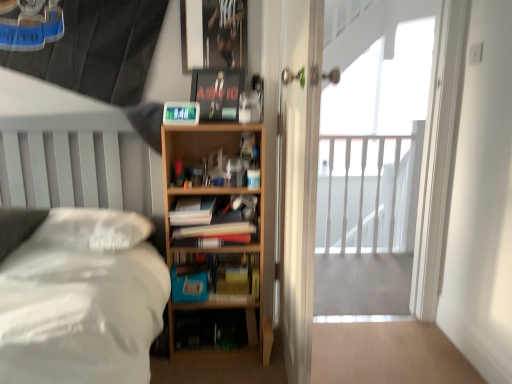
The height and width of the screenshot is (384, 512). Identify the location of white glossy screen door at center. (298, 178).

The image size is (512, 384). What do you see at coordinates (367, 192) in the screenshot? I see `white wooden railing at upper right` at bounding box center [367, 192].

This screenshot has width=512, height=384. In order to click on white wooden railing at upper right in this screenshot , I will do `click(367, 192)`.

This screenshot has width=512, height=384. Identify the location of white wooden railing at upper right. (376, 128).

The width and height of the screenshot is (512, 384). What are the coordinates of `hardcover book at center, the first book when ordered from bottom to top` in the screenshot? It's located at (220, 276).

Describe the element at coordinates (220, 276) in the screenshot. This screenshot has height=384, width=512. I see `hardcover book at center, acting as the second book starting from the top` at that location.

Locate an element on the screen. The image size is (512, 384). white glossy screen door at center is located at coordinates (298, 178).

Could you tell me if white glossy screen door at center is facing matte black paperback book at upper center, the 2th paperback book from the bottom?

No, white glossy screen door at center is not facing towards matte black paperback book at upper center, the 2th paperback book from the bottom.

Is white glossy screen door at center directly adjacent to matte black paperback book at upper center, the 2th paperback book from the bottom?

There is a gap between white glossy screen door at center and matte black paperback book at upper center, the 2th paperback book from the bottom.

Between white glossy screen door at center and matte black paperback book at upper center, placed as the first paperback book when sorted from top to bottom, which one has larger width?

Wider between the two is white glossy screen door at center.

Which point is more distant from viewer, (290,173) or (229,93)?

The point (229,93) is farther from the camera.

Measure the distance between white wooden railing at upper right and wooden bookcase at center.

white wooden railing at upper right is 5.15 feet from wooden bookcase at center.

Is wooden bookcase at center located within white wooden railing at upper right?

No.

Considering the positions of objects white wooden railing at upper right and wooden bookcase at center in the image provided, who is more to the left, white wooden railing at upper right or wooden bookcase at center?

wooden bookcase at center is more to the left.

From a real-world perspective, who is located lower, white wooden railing at upper right or wooden bookcase at center?

In real-world perspective, wooden bookcase at center is lower.

Between hardcover book at center, acting as the second book starting from the top, and matte black paperback book at upper center, the 2th paperback book from the bottom, which one is positioned behind?

Positioned behind is hardcover book at center, acting as the second book starting from the top.

From a real-world perspective, is hardcover book at center, the first book when ordered from bottom to top, over matte black paperback book at upper center, placed as the first paperback book when sorted from top to bottom?

No, from a real-world perspective, hardcover book at center, the first book when ordered from bottom to top, is not above matte black paperback book at upper center, placed as the first paperback book when sorted from top to bottom.

How many degrees apart are the facing directions of hardcover book at center, acting as the second book starting from the top, and matte black paperback book at upper center, placed as the first paperback book when sorted from top to bottom?

The angular difference between hardcover book at center, acting as the second book starting from the top, and matte black paperback book at upper center, placed as the first paperback book when sorted from top to bottom, is 16.7 degrees.

Considering the sizes of objects hardcover book at center, the first book when ordered from bottom to top, and matte black paperback book at upper center, placed as the first paperback book when sorted from top to bottom, in the image provided, who is thinner, hardcover book at center, the first book when ordered from bottom to top, or matte black paperback book at upper center, placed as the first paperback book when sorted from top to bottom,?

With smaller width is hardcover book at center, the first book when ordered from bottom to top.

How far apart are blue matte paperback book at lower center, the first paperback book ordered from the bottom, and white glossy screen door at center?

They are 25.32 inches apart.

From the image's perspective, is blue matte paperback book at lower center, the first paperback book ordered from the bottom, on white glossy screen door at center?

No, from the image's perspective, blue matte paperback book at lower center, the first paperback book ordered from the bottom, is not on top of white glossy screen door at center.

Visually, is blue matte paperback book at lower center, the first paperback book ordered from the bottom, positioned to the left or to the right of white glossy screen door at center?

In the image, blue matte paperback book at lower center, the first paperback book ordered from the bottom, appears on the left side of white glossy screen door at center.

Between point (206, 278) and point (308, 165), which one is positioned in front?

The point (308, 165) is closer to the camera.

Is blue matte paperback book at lower center, which appears as the 2th paperback book when viewed from the top, surrounding wooden bookcase at center?

That's incorrect, wooden bookcase at center is not inside blue matte paperback book at lower center, which appears as the 2th paperback book when viewed from the top.

From a real-world perspective, is blue matte paperback book at lower center, which appears as the 2th paperback book when viewed from the top, physically located above or below wooden bookcase at center?

In terms of real-world spatial position, blue matte paperback book at lower center, which appears as the 2th paperback book when viewed from the top, is below wooden bookcase at center.

Can you confirm if blue matte paperback book at lower center, which appears as the 2th paperback book when viewed from the top, is shorter than wooden bookcase at center?

Correct, blue matte paperback book at lower center, which appears as the 2th paperback book when viewed from the top, is not as tall as wooden bookcase at center.

Which is closer to the camera, (298, 125) or (400, 160)?

Point (298, 125) appears to be closer to the viewer than point (400, 160).

Who is taller, white glossy screen door at center or white wooden railing at upper right?

white glossy screen door at center is taller.

Who is smaller, white glossy screen door at center or white wooden railing at upper right?

Smaller between the two is white wooden railing at upper right.

From a real-world perspective, is white glossy screen door at center positioned above or below white wooden railing at upper right?

white glossy screen door at center is situated higher than white wooden railing at upper right in the real world.

In the scene shown: Based on their sizes in the image, would you say hardcover books at center, the second book positioned from the bottom, is bigger or smaller than wooden bookcase at center?

Considering their sizes, hardcover books at center, the second book positioned from the bottom, takes up less space than wooden bookcase at center.

From a real-world perspective, does hardcover books at center, the first book from the top, sit lower than wooden bookcase at center?

No, from a real-world perspective, hardcover books at center, the first book from the top, is not under wooden bookcase at center.

Which paperback book is the 1st one when counting from the left side of the white glossy screen door at center? Please provide its 2D coordinates.

[(217, 92)]

Image resolution: width=512 pixels, height=384 pixels. What are the coordinates of `bookcase in front of the white wooden railing at upper right` in the screenshot? It's located at [201, 155].

Considering their positions, is white wooden railing at upper right positioned further to wooden bookcase at center than white glossy screen door at center?

white wooden railing at upper right is further to wooden bookcase at center.

Based on their spatial positions, is white wooden railing at upper right or matte black paperback book at upper center, placed as the first paperback book when sorted from top to bottom, closer to blue matte paperback book at lower center, the first paperback book ordered from the bottom?

matte black paperback book at upper center, placed as the first paperback book when sorted from top to bottom, is closer to blue matte paperback book at lower center, the first paperback book ordered from the bottom.

Looking at the image, which one is located closer to white wooden railing at upper right, hardcover books at center, the second book positioned from the bottom, or wooden bookcase at center?

wooden bookcase at center is closer to white wooden railing at upper right.

Considering their positions, is hardcover book at center, acting as the second book starting from the top, positioned further to matte black paperback book at upper center, the 2th paperback book from the bottom, than white wooden railing at upper right?

The object further to matte black paperback book at upper center, the 2th paperback book from the bottom, is white wooden railing at upper right.

When comparing their distances from white wooden railing at upper right, does hardcover books at center, the first book from the top, or blue matte paperback book at lower center, which appears as the 2th paperback book when viewed from the top, seem closer?

hardcover books at center, the first book from the top, lies closer to white wooden railing at upper right than the other object.

Which object lies nearer to the anchor point matte black paperback book at upper center, the 2th paperback book from the bottom, wooden bookcase at center or hardcover books at center, the first book from the top?

wooden bookcase at center is closer to matte black paperback book at upper center, the 2th paperback book from the bottom.

Based on their spatial positions, is wooden bookcase at center or matte black paperback book at upper center, placed as the first paperback book when sorted from top to bottom, closer to white glossy screen door at center?

Among the two, wooden bookcase at center is located nearer to white glossy screen door at center.

Considering their positions, is hardcover book at center, acting as the second book starting from the top, positioned further to white wooden railing at upper right than hardcover books at center, the second book positioned from the bottom?

hardcover book at center, acting as the second book starting from the top, is further to white wooden railing at upper right.

The image size is (512, 384). What are the coordinates of `window between matte black paperback book at upper center, the 2th paperback book from the bottom, and white wooden railing at upper right from front to back` in the screenshot? It's located at (376, 128).

You are a GUI agent. You are given a task and a screenshot of the screen. Output one action in this format:
    pyautogui.click(x=<x>, y=<y>)
    Task: Click on the book located between hardcover books at center, the first book from the top, and white wooden railing at upper right in the depth direction
    The height and width of the screenshot is (384, 512).
    Given the screenshot: What is the action you would take?
    pyautogui.click(x=220, y=276)

You are a GUI agent. You are given a task and a screenshot of the screen. Output one action in this format:
    pyautogui.click(x=<x>, y=<y>)
    Task: Click on the window between blue matte paperback book at lower center, the first paperback book ordered from the bottom, and white wooden railing at upper right in the front-back direction
    
    Given the screenshot: What is the action you would take?
    pyautogui.click(x=376, y=128)

Where is `paperback book located between white matte bed at left and blue matte paperback book at lower center, which appears as the 2th paperback book when viewed from the top, in the depth direction`? This screenshot has width=512, height=384. paperback book located between white matte bed at left and blue matte paperback book at lower center, which appears as the 2th paperback book when viewed from the top, in the depth direction is located at coordinates (217, 92).